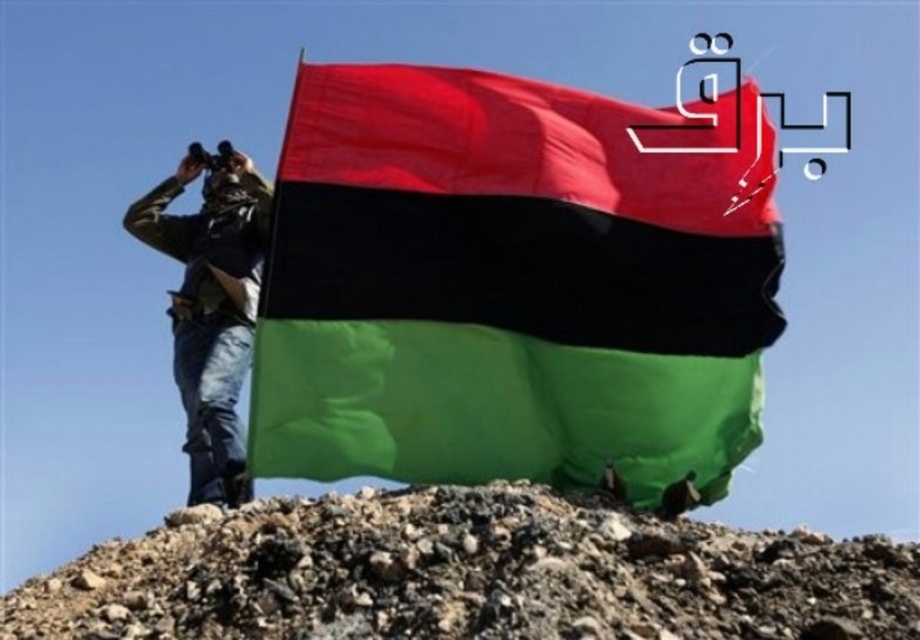
You are a photographer trying to capture the polyester flag at center in the image. The flag is located at coordinates point 0.445, 0.561. If your camera has a focal length of 50mm and you are positioned 2 meters away from the flag, will the flag be fully visible in your frame? Assume the camera sensor has a diagonal measurement of 28mm and the field of view at 50mm is approximately 46 degrees diagonally.

The polyester flag at center is located at point (515, 284). To determine visibility, calculate the field of view coverage. With a 50mm lens and 2m distance, the diagonal field of view covers about 46 degrees. The sensor diagonal is 28mm, so using trigonometry, the maximum distance across the frame would be 2m multiplied by tan 23 degrees. This results in approximately 0.83 meters. Since the flag is within this distance, it should be fully visible in the frame.

You are a photographer trying to capture the polyester flag at center and the rough gravel hill at center in a single shot. Based on their sizes, which object will appear larger in the photo?

The polyester flag at center will appear larger in the photo since it has a greater height than the rough gravel hill at center.

You are a photographer trying to capture the polyester flag at center and the camouflage fabric jacket at center in the same frame. Since the flag is larger than the jacket, how should you position your camera to ensure both are fully visible?

Since the polyester flag at center is larger than the camouflage fabric jacket at center, you should position your camera farther away to capture both objects in the frame without cropping either of them.